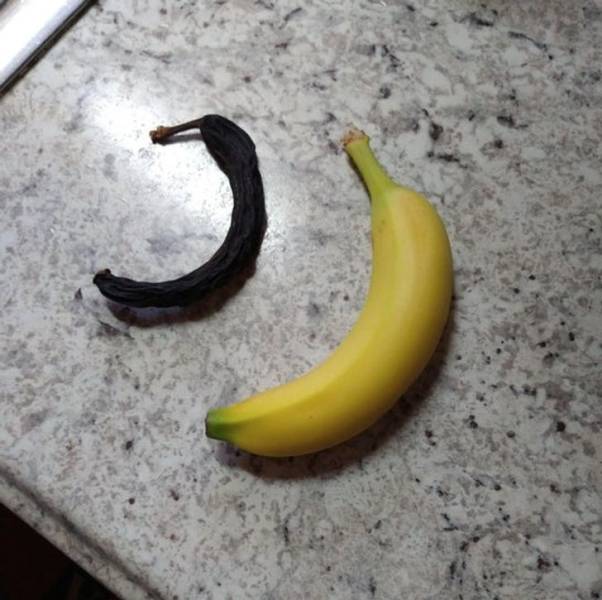
Identify the location of counter. Image resolution: width=602 pixels, height=600 pixels. (488, 529).